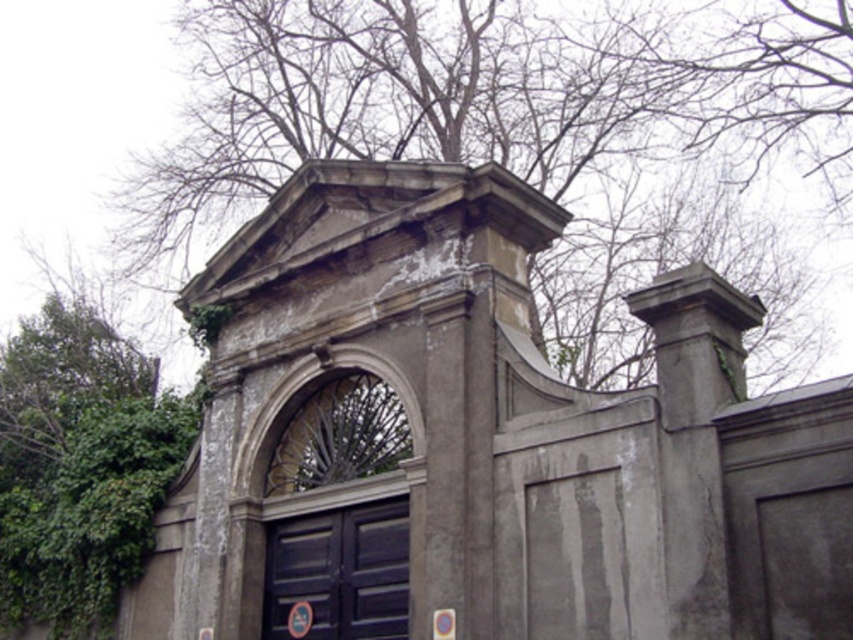
Looking at this image, you are an architect designing a new building and want to incorporate elements from this historical structure. You need to ensure that the green leafy tree at upper center and the dark blue wooden door at center are proportionally scaled. Which object should be wider in your design?

The green leafy tree at upper center should be wider than the dark blue wooden door at center because the description states that its width is larger.

You are standing in front of the dark blue wooden door at center and want to look up to see the green leafy tree at upper center. In which direction should you turn your head?

You should turn your head to the right to see the green leafy tree at upper center, as it is positioned to the right of the dark blue wooden door at center.